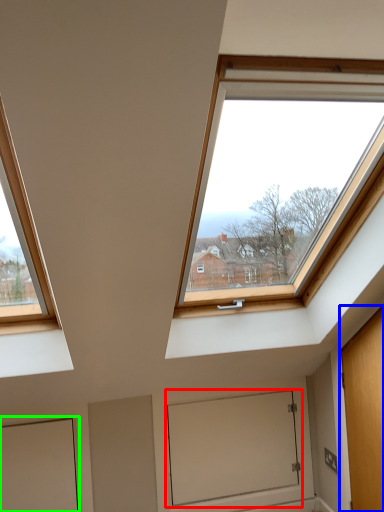
Question: Estimate the real-world distances between objects in this image. Which object is closer to window screen (highlighted by a red box), door (highlighted by a blue box) or door (highlighted by a green box)?

Choices:
 (A) door
 (B) door

Answer: (A)